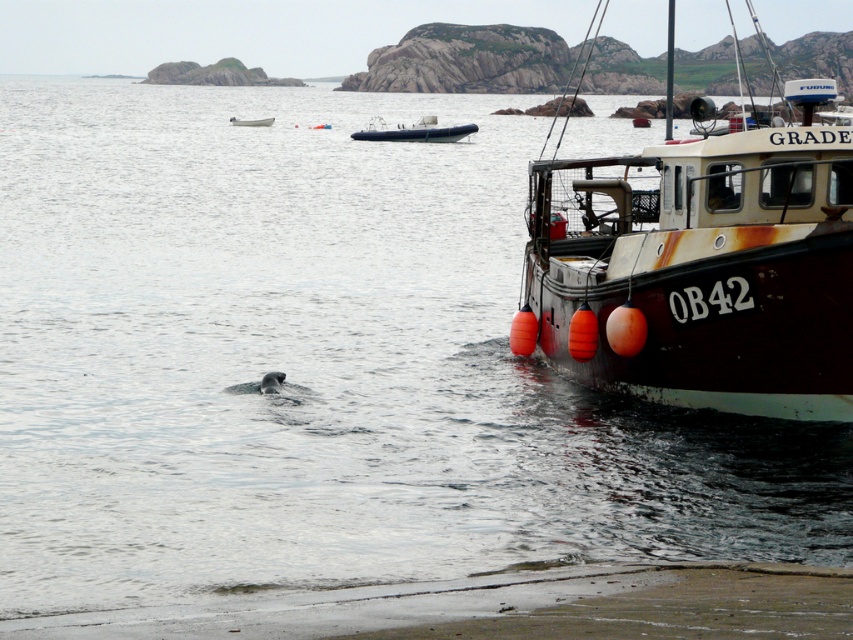
Question: Which of the following is the farthest from the observer?

Choices:
 (A) (428, 129)
 (B) (231, 124)
 (C) (398, 611)

Answer: (B)

Question: Which object appears farthest from the camera in this image?

Choices:
 (A) white plastic dinghy at upper left
 (B) blue rubber dinghy at upper center

Answer: (A)

Question: Which is nearer to the blue rubber dinghy at upper center?

Choices:
 (A) sandy beach at lower left
 (B) white plastic dinghy at upper left
 (C) rusty metal boat at right

Answer: (B)

Question: Where is blue rubber dinghy at upper center located in relation to white plastic dinghy at upper left in the image?

Choices:
 (A) left
 (B) right

Answer: (B)

Question: Where is blue rubber dinghy at upper center located in relation to white plastic dinghy at upper left in the image?

Choices:
 (A) above
 (B) below

Answer: (B)

Question: In this image, where is blue rubber dinghy at upper center located relative to white plastic dinghy at upper left?

Choices:
 (A) below
 (B) above

Answer: (A)